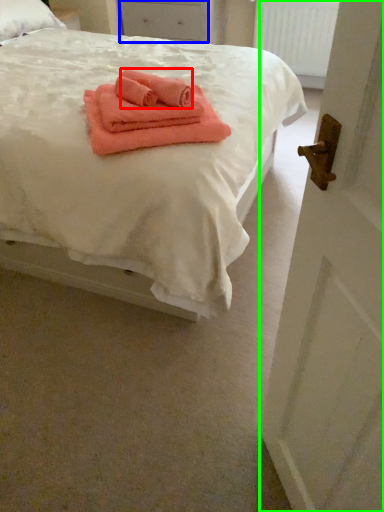
Question: Based on their relative distances, which object is farther from cloth (highlighted by a red box)? Choose from drawer (highlighted by a blue box) and door (highlighted by a green box).

Choices:
 (A) drawer
 (B) door

Answer: (A)